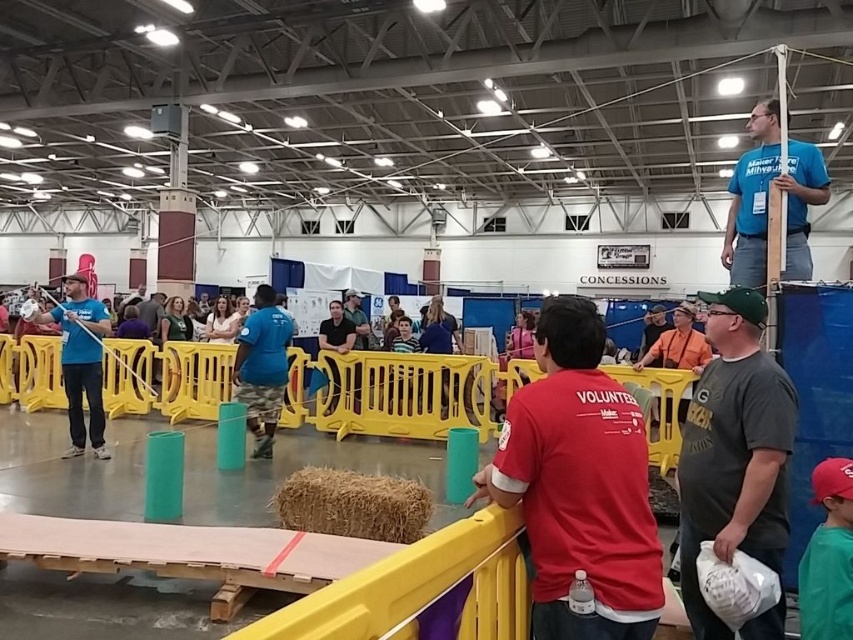
Does blue cotton shirt at center lie behind dark blue shirt at center?

That is False.

Between blue cotton shirt at center and dark blue shirt at center, which one is positioned lower?

blue cotton shirt at center is below.

Identify the location of blue cotton shirt at center. This screenshot has width=853, height=640. (262, 368).

Consider the image. Who is positioned more to the right, blue t-shirt at upper right or dark blue shirt at center?

From the viewer's perspective, blue t-shirt at upper right appears more on the right side.

How distant is blue t-shirt at upper right from dark blue shirt at center?

They are 14.45 feet apart.

Who is more forward, (775, 100) or (350, 336)?

Positioned in front is point (775, 100).

Where is `blue t-shirt at upper right`? Image resolution: width=853 pixels, height=640 pixels. blue t-shirt at upper right is located at coordinates (767, 196).

Is point (819, 579) positioned after point (33, 321)?

That is False.

This screenshot has width=853, height=640. Describe the element at coordinates (828, 556) in the screenshot. I see `green jersey at lower right` at that location.

What are the coordinates of `green jersey at lower right` in the screenshot? It's located at (828, 556).